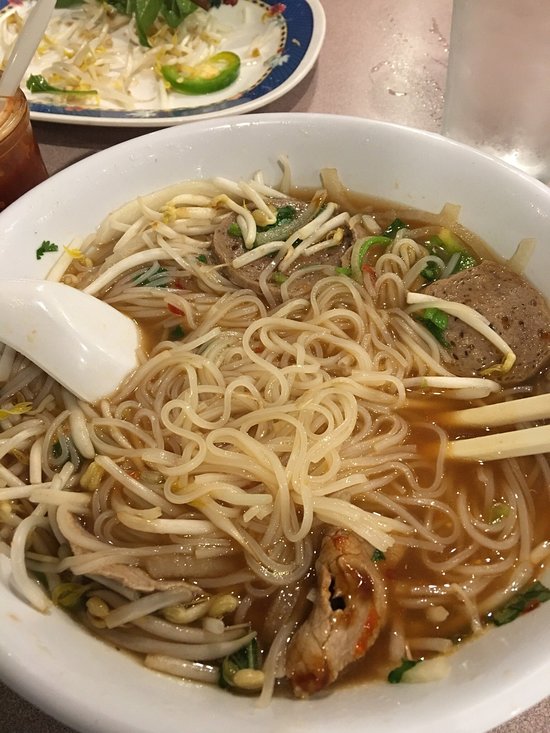
Identify the location of glass. (476, 91).